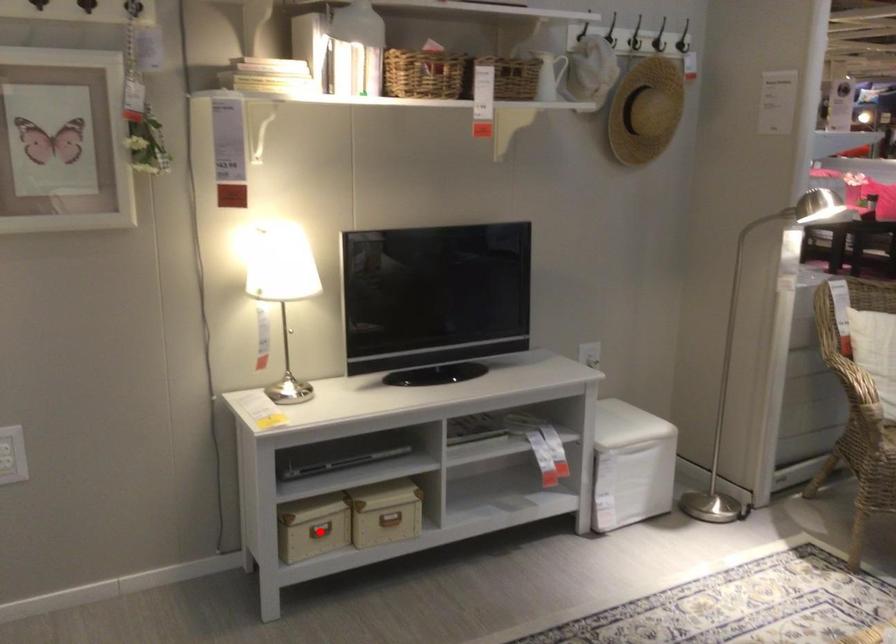
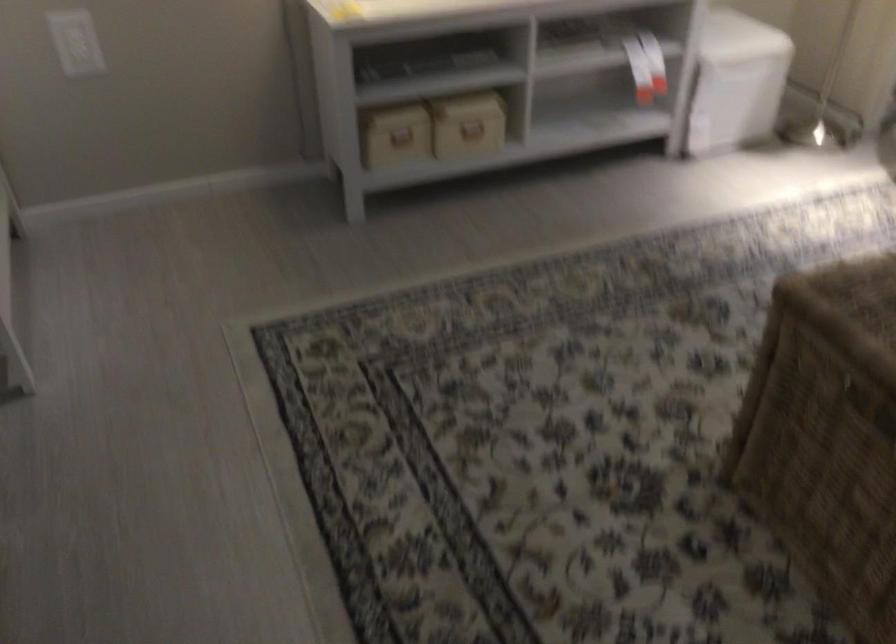
Where in the second image is the point corresponding to the highlighted location from the first image?

(401, 136)